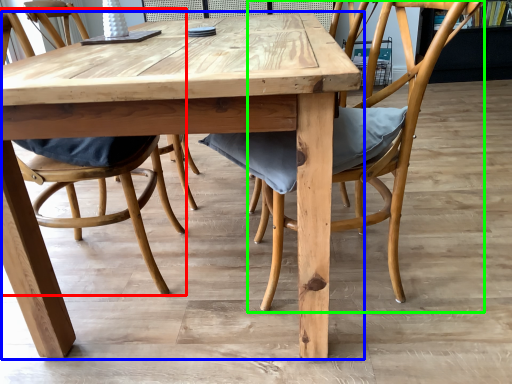
Question: Estimate the real-world distances between objects in this image. Which object is closer to chair (highlighted by a red box), kitchen & dining room table (highlighted by a blue box) or chair (highlighted by a green box)?

Choices:
 (A) kitchen & dining room table
 (B) chair

Answer: (A)